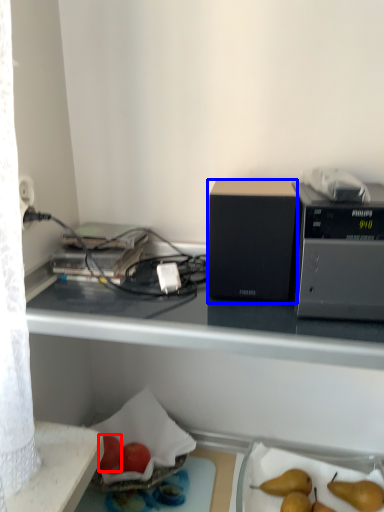
Question: Among these objects, which one is farthest to the camera, apple (highlighted by a red box) or appliance (highlighted by a blue box)?

Choices:
 (A) apple
 (B) appliance

Answer: (A)